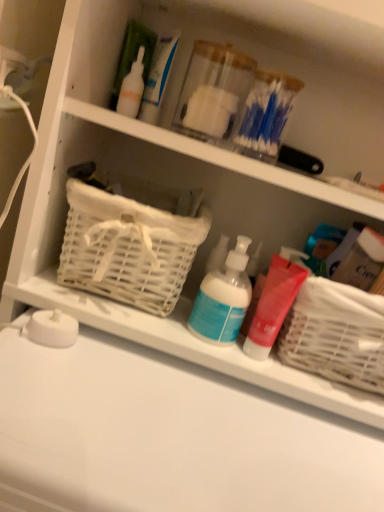
The width and height of the screenshot is (384, 512). I want to click on free space above white matte counter top at lower center (from a real-world perspective), so click(199, 418).